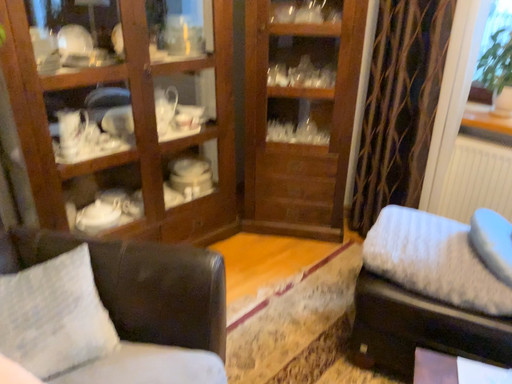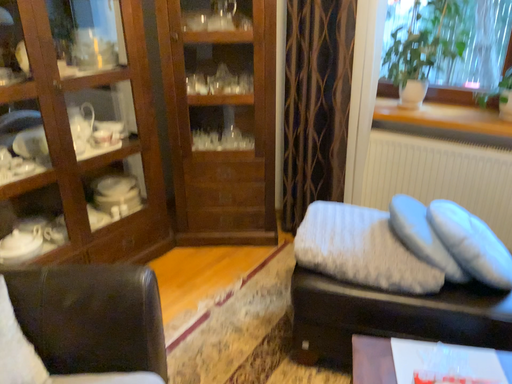
Question: Which way did the camera rotate in the video?

Choices:
 (A) rotated right
 (B) rotated left

Answer: (A)